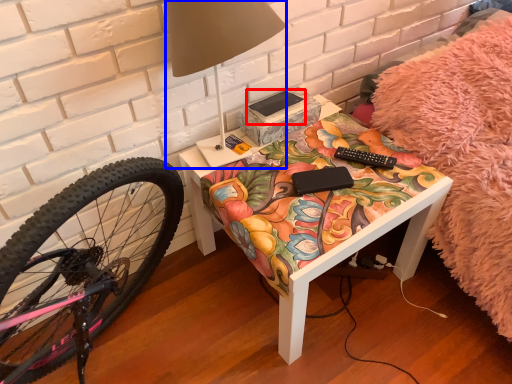
Question: Which object is further to the camera taking this photo, book (highlighted by a red box) or table lamp (highlighted by a blue box)?

Choices:
 (A) book
 (B) table lamp

Answer: (A)